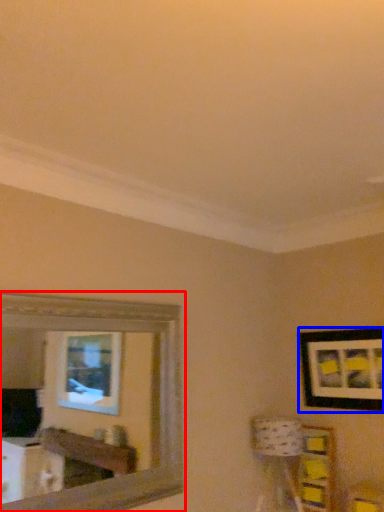
Question: Which object is further to the camera taking this photo, mirror (highlighted by a red box) or picture frame (highlighted by a blue box)?

Choices:
 (A) mirror
 (B) picture frame

Answer: (B)